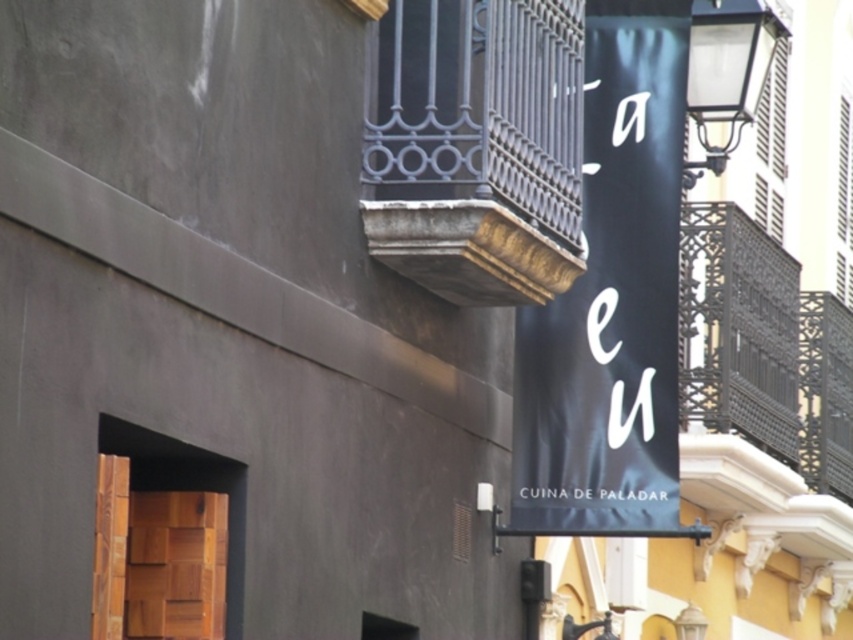
Question: Can you confirm if black fabric banner at center is smaller than dark wrought iron balcony at upper center?

Choices:
 (A) yes
 (B) no

Answer: (B)

Question: Which of the following is the farthest from the observer?

Choices:
 (A) (538, 328)
 (B) (548, 8)

Answer: (A)

Question: Is black fabric banner at center further to camera compared to dark wrought iron balcony at upper center?

Choices:
 (A) yes
 (B) no

Answer: (A)

Question: Is black fabric banner at center below dark wrought iron balcony at upper center?

Choices:
 (A) yes
 (B) no

Answer: (A)

Question: Which object appears closest to the camera in this image?

Choices:
 (A) dark wrought iron balcony at upper center
 (B) black fabric banner at center

Answer: (A)

Question: Which of the following is the farthest from the observer?

Choices:
 (A) dark wrought iron balcony at upper center
 (B) black fabric banner at center

Answer: (B)